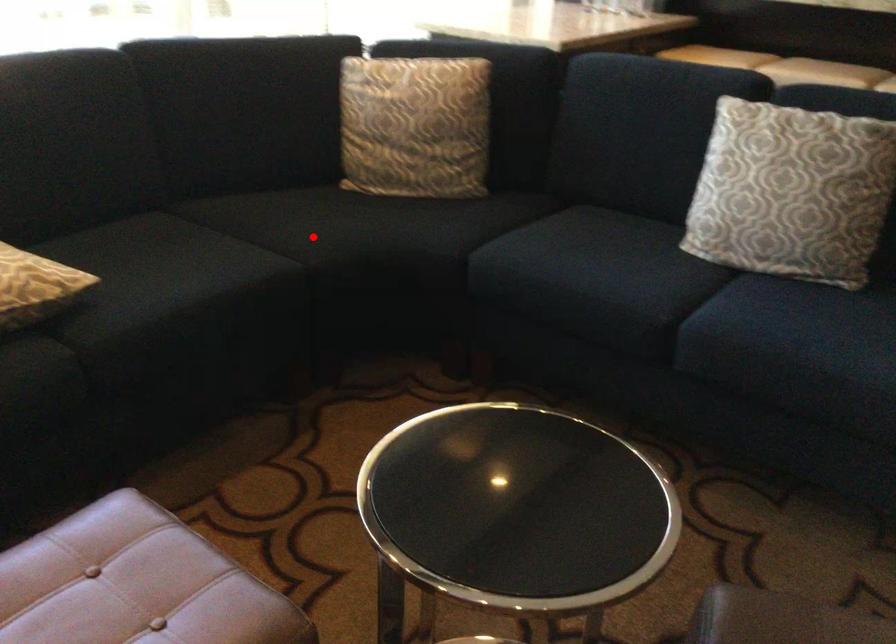
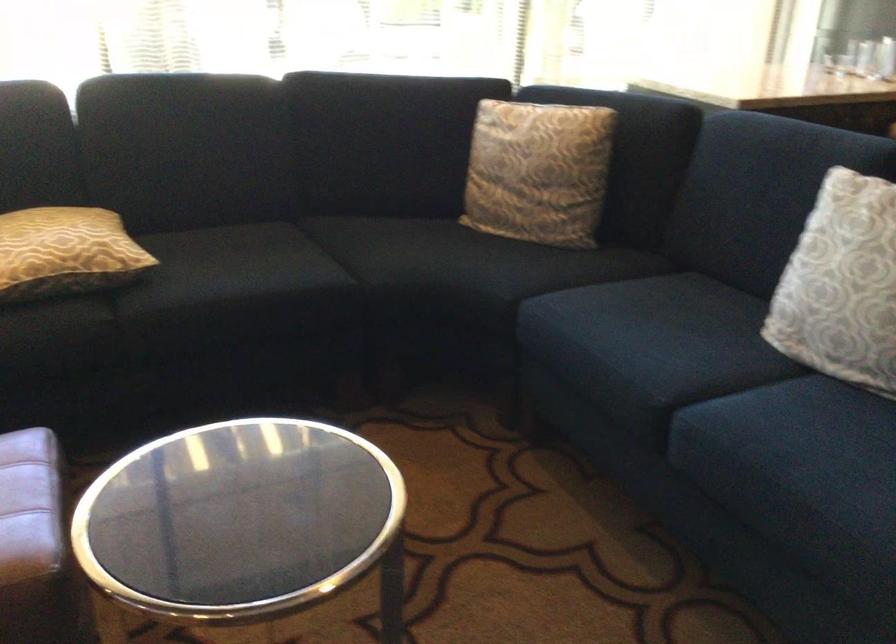
Find the pixel in the second image that matches the highlighted location in the first image.

(391, 261)